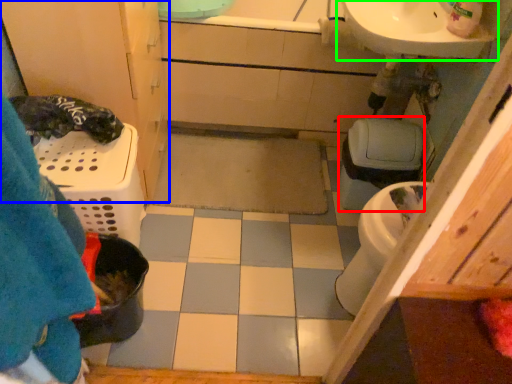
Question: Which is farther away from toilet bowl (highlighted by a red box)? bathroom cabinet (highlighted by a blue box) or sink (highlighted by a green box)?

Choices:
 (A) bathroom cabinet
 (B) sink

Answer: (A)